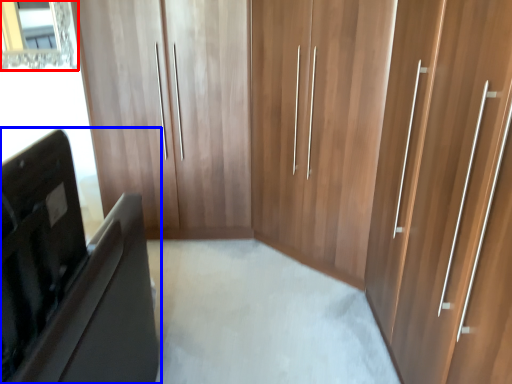
Question: Which of the following is the closest to the observer, mirror (highlighted by a red box) or furniture (highlighted by a blue box)?

Choices:
 (A) mirror
 (B) furniture

Answer: (B)